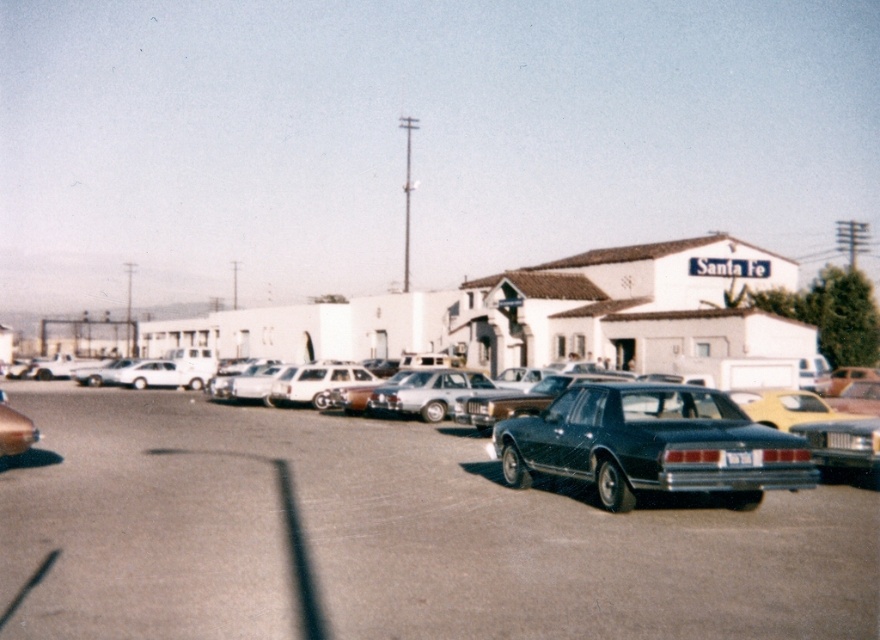
Does shiny black car at center have a smaller size compared to black plastic license plate at center?

No, shiny black car at center is not smaller than black plastic license plate at center.

Between point (682, 620) and point (732, 452), which one is positioned behind?

The point (732, 452) is more distant.

Where is `shiny black car at center`? This screenshot has width=880, height=640. shiny black car at center is located at coordinates (386, 536).

Between shiny black car at center and shiny dark blue sedan at center, which one appears on the right side from the viewer's perspective?

shiny dark blue sedan at center is more to the right.

Who is more forward, (100, 564) or (717, 483)?

Positioned in front is point (100, 564).

Between point (462, 556) and point (717, 461), which one is positioned in front?

Point (462, 556)

I want to click on shiny black car at center, so click(386, 536).

From the picture: Is shiny dark blue sedan at center to the left of black plastic license plate at center from the viewer's perspective?

Yes, shiny dark blue sedan at center is to the left of black plastic license plate at center.

Who is higher up, shiny dark blue sedan at center or black plastic license plate at center?

Positioned higher is shiny dark blue sedan at center.

This screenshot has height=640, width=880. In order to click on shiny dark blue sedan at center in this screenshot , I will do `click(650, 444)`.